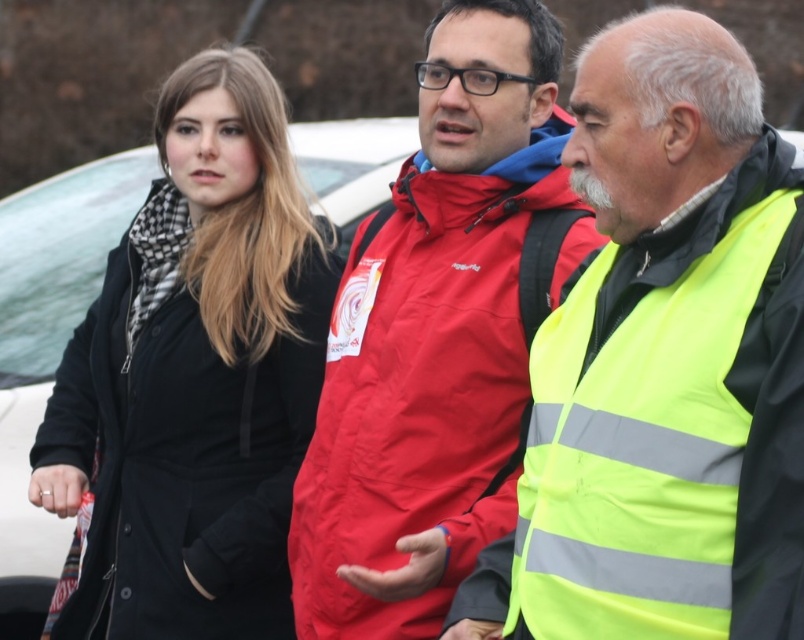
Is reflective yellow vest at right further to the viewer compared to red matte jacket at center?

No.

Can you confirm if reflective yellow vest at right is positioned to the right of red matte jacket at center?

Correct, you'll find reflective yellow vest at right to the right of red matte jacket at center.

Is point (658, 266) positioned in front of point (482, 436)?

Yes.

At what (x,y) coordinates should I click in order to perform the action: click on reflective yellow vest at right. Please return your answer as a coordinate pair (x, y). Looking at the image, I should click on (663, 365).

Find the location of a particular element. The width and height of the screenshot is (804, 640). black matte coat at left is located at coordinates (195, 376).

Which is more to the left, black matte coat at left or red matte jacket at center?

From the viewer's perspective, black matte coat at left appears more on the left side.

Locate an element on the screen. Image resolution: width=804 pixels, height=640 pixels. black matte coat at left is located at coordinates (195, 376).

Is point (546, 436) closer to camera compared to point (120, 637)?

Yes, point (546, 436) is closer to viewer.

The image size is (804, 640). What do you see at coordinates (663, 365) in the screenshot?
I see `reflective yellow vest at right` at bounding box center [663, 365].

Who is more distant from viewer, (610, 189) or (269, 252)?

Point (269, 252)

The width and height of the screenshot is (804, 640). What are the coordinates of `reflective yellow vest at right` in the screenshot? It's located at (663, 365).